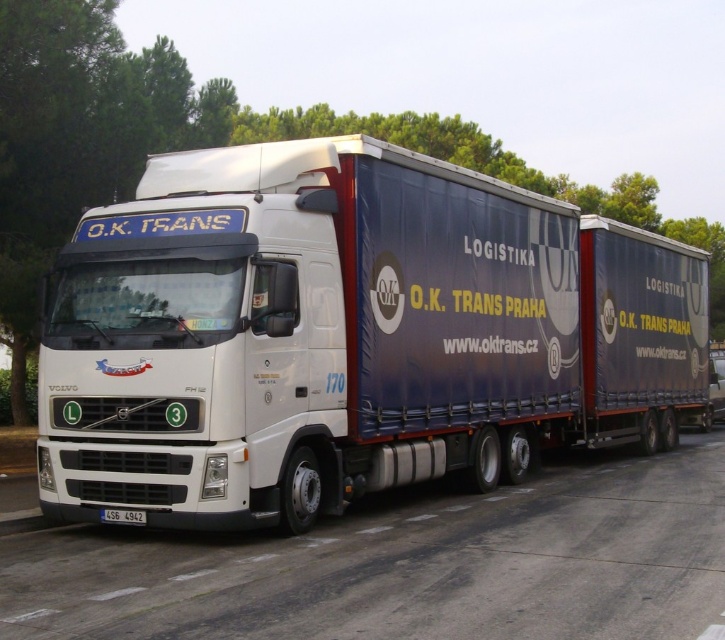
You are a delivery driver who needs to park your white matte truck at center in a parking spot that is exactly the width of the white plastic license plate at center. Can your truck fit into this parking spot?

The white matte truck at center might be wider than the white plastic license plate at center, so there is a possibility that the truck will not fit into the parking spot designed for the license plate width.

You are a photographer standing in front of the white matte truck at center and the white plastic license plate at center. You want to take a photo that includes both objects. Which object should you focus on first to ensure both are in frame?

You should focus on the white matte truck at center first because it is larger than the white plastic license plate at center, so it will take up more space in the photo and ensure both are visible.